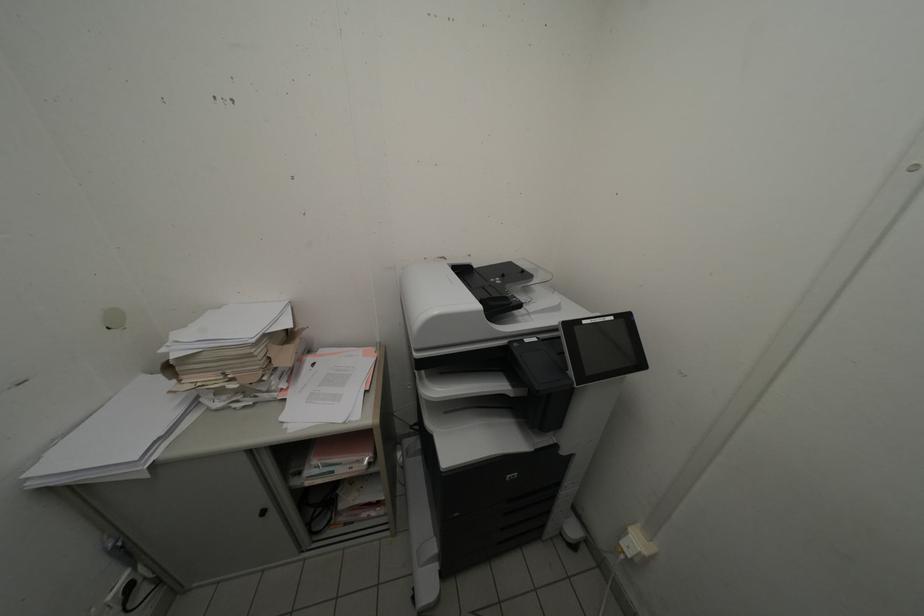
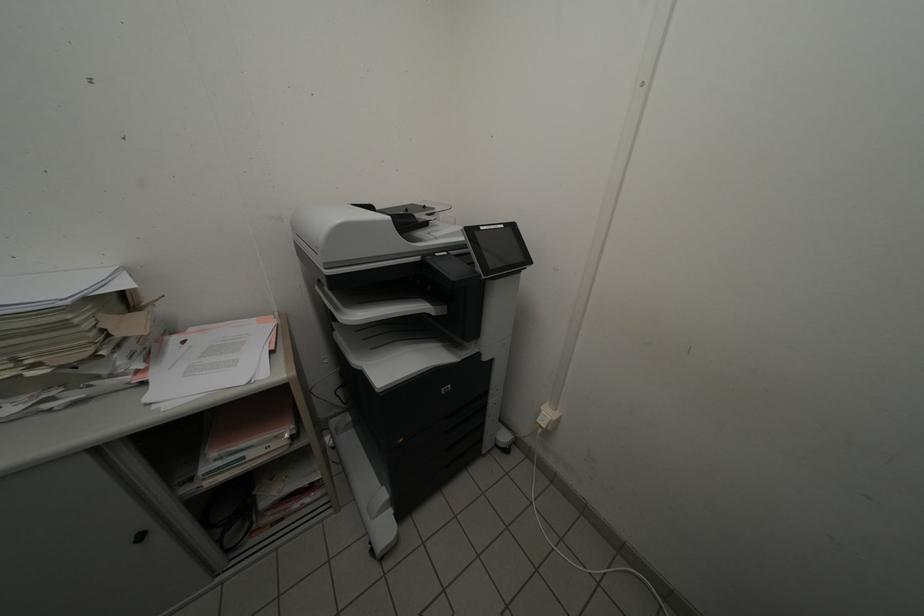
Where in the second image is the point corresponding to point (441, 435) from the first image?

(370, 369)